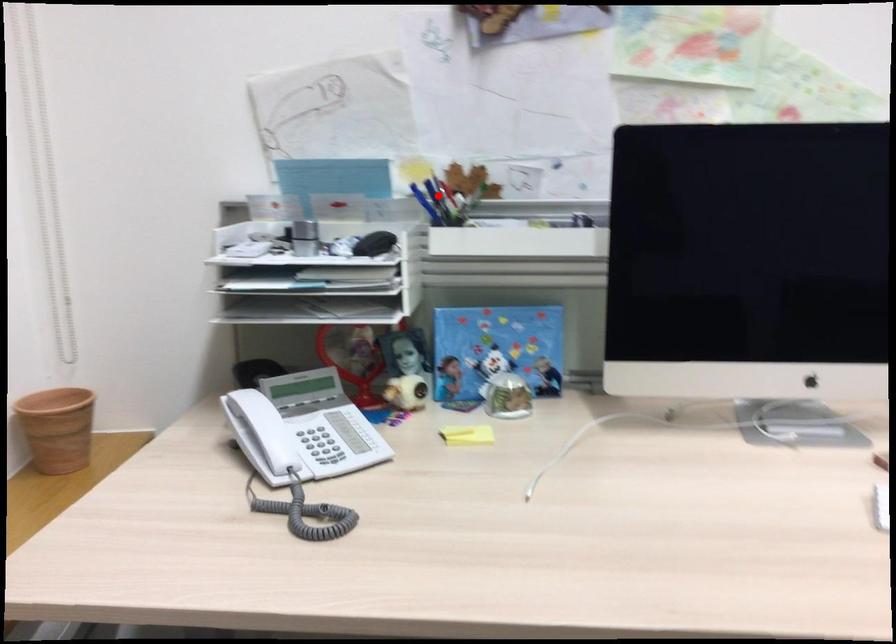
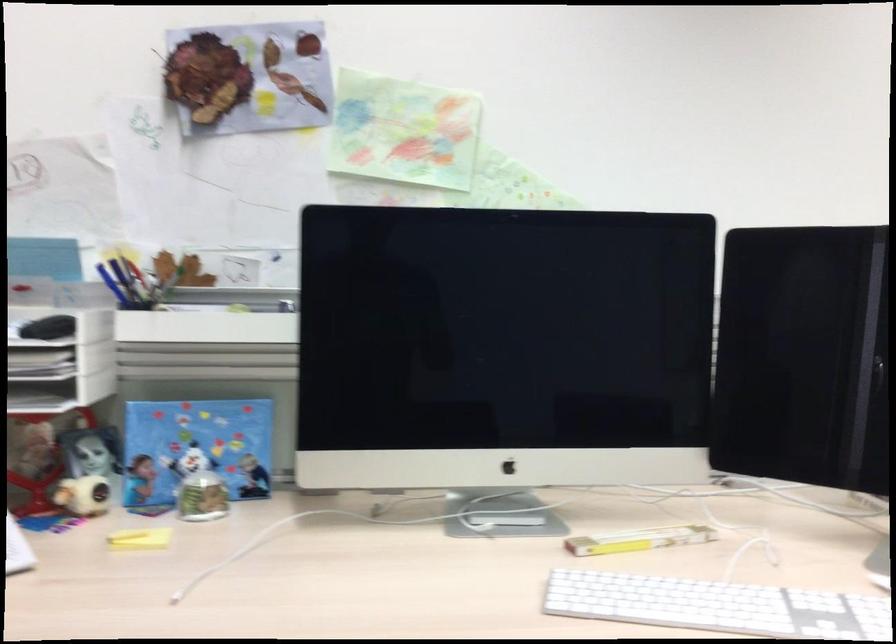
Locate, in the second image, the point that corresponds to the highlighted location in the first image.

(126, 281)